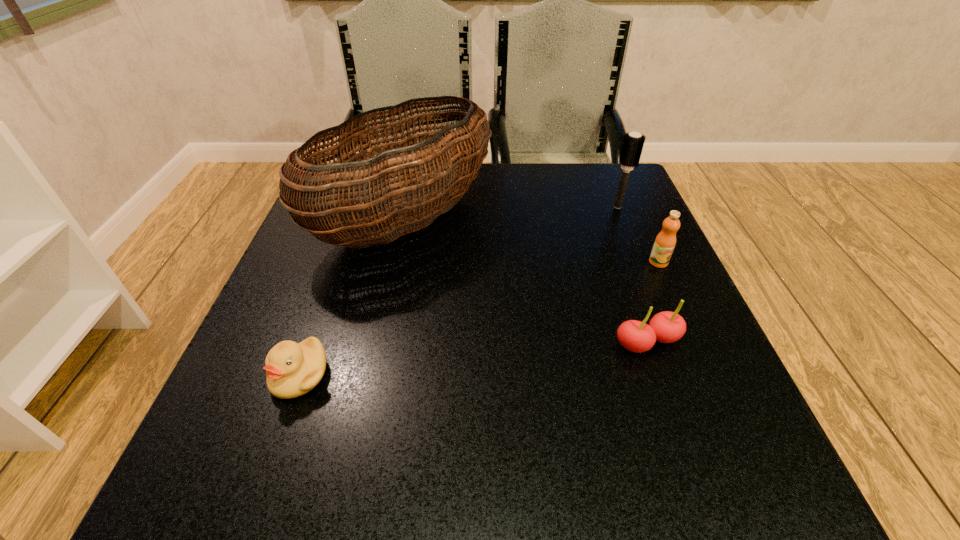
At what (x,y) coordinates should I click in order to perform the action: click on free point between the cherry and the duckling. Please return your answer as a coordinate pair (x, y). This screenshot has width=960, height=540. Looking at the image, I should click on (473, 359).

You are a GUI agent. You are given a task and a screenshot of the screen. Output one action in this format:
    pyautogui.click(x=<x>, y=<y>)
    Task: Click on the free space that is in between the basket and the hairbrush
    
    Given the screenshot: What is the action you would take?
    pyautogui.click(x=512, y=213)

Locate an element on the screen. empty location between the cherry and the fourth shortest object is located at coordinates pos(633,275).

Point out which object is positioned as the fourth nearest to the orange juice. Please provide its 2D coordinates. Your answer should be formatted as a tuple, i.e. [(x, y)], where the tuple contains the x and y coordinates of a point satisfying the conditions above.

[(292, 369)]

Find the location of a particular element. This screenshot has width=960, height=540. object that stands as the second closest to the duckling is located at coordinates (666, 327).